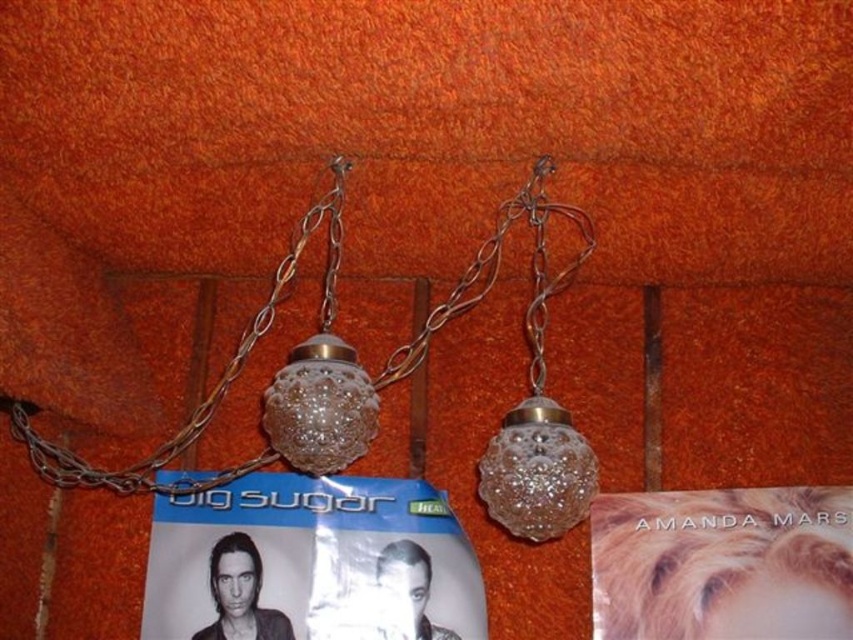
Where is `matte paper poster at center`? matte paper poster at center is located at coordinates click(311, 563).

From the picture: Is matte paper poster at center shorter than clear glass globe at center?

Yes.

Between point (196, 637) and point (323, 392), which one is positioned behind?

Positioned behind is point (196, 637).

Where is `matte paper poster at center`? matte paper poster at center is located at coordinates (311, 563).

Is clear glass globe at center further to the viewer compared to metallic chain at left?

No, clear glass globe at center is in front of metallic chain at left.

Can you confirm if clear glass globe at center is shorter than metallic chain at left?

Indeed, clear glass globe at center has a lesser height compared to metallic chain at left.

Identify the location of clear glass globe at center. (322, 380).

In order to click on clear glass globe at center in this screenshot , I will do `click(322, 380)`.

Can you confirm if matte paper poster at center is taller than metallic chain at left?

No.

Who is more forward, (x=247, y=561) or (x=283, y=276)?

Point (x=283, y=276)

Where is `matte paper poster at center`? This screenshot has height=640, width=853. matte paper poster at center is located at coordinates (311, 563).